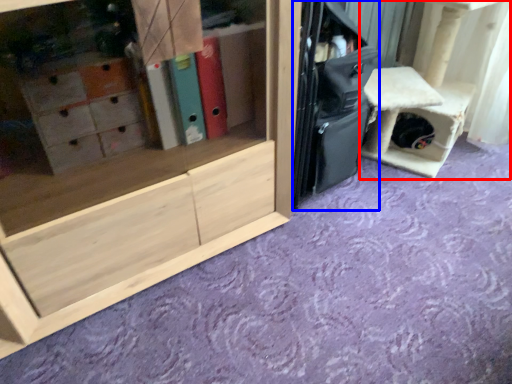
Question: Which point is further to the camera, furniture (highlighted by a red box) or luggage (highlighted by a blue box)?

Choices:
 (A) furniture
 (B) luggage

Answer: (A)